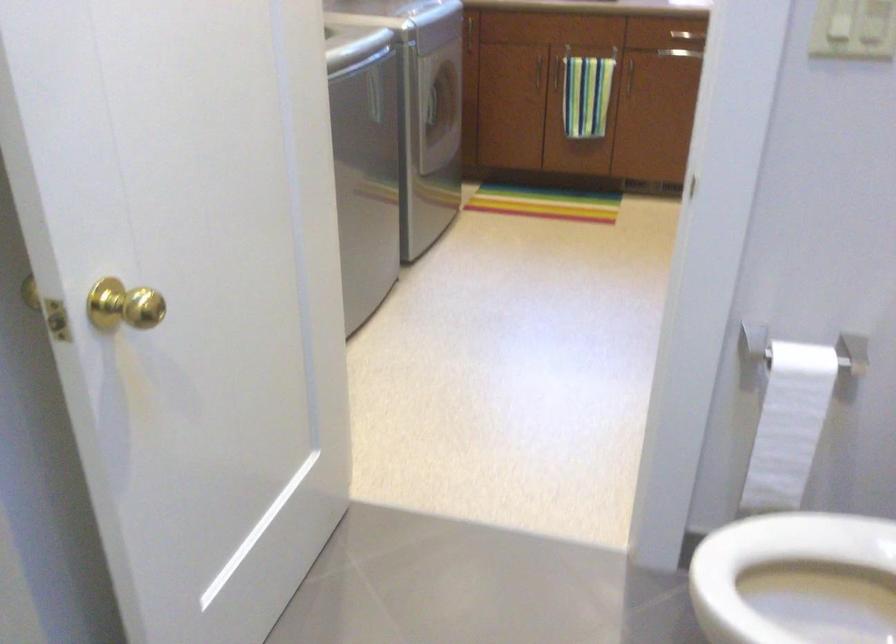
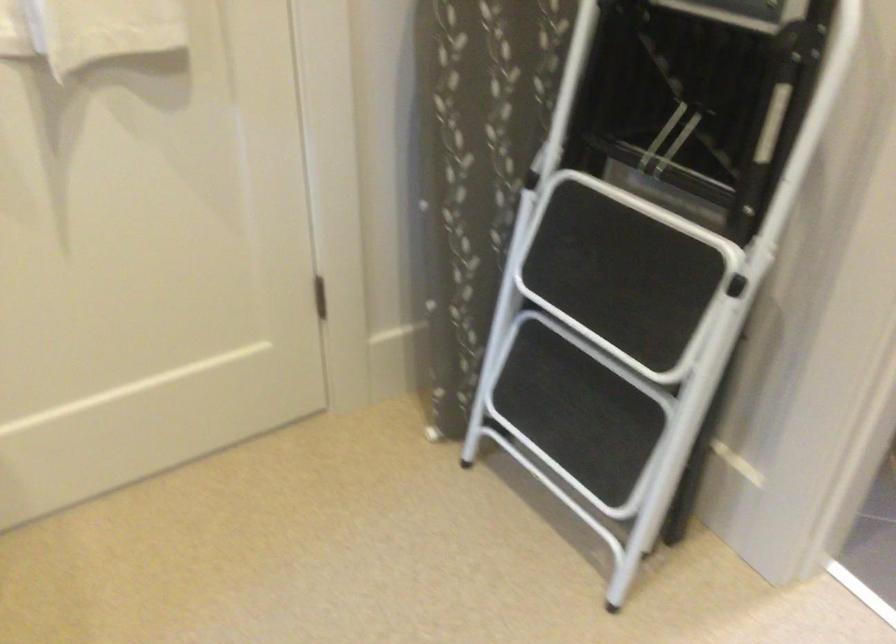
The point at (819,336) is marked in the first image. Where is the corresponding point in the second image?

(607, 342)